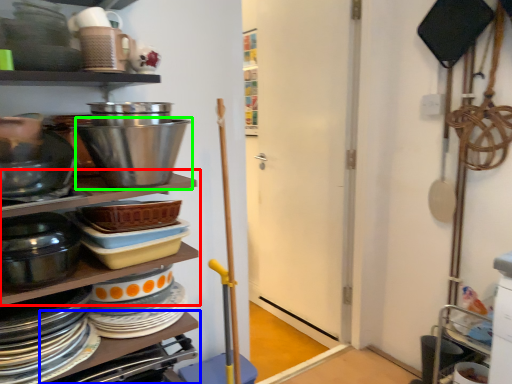
Question: Which object is positioned farthest from shelf (highlighted by a red box)? Select from table (highlighted by a blue box) and bowl (highlighted by a green box).

Choices:
 (A) table
 (B) bowl

Answer: (A)